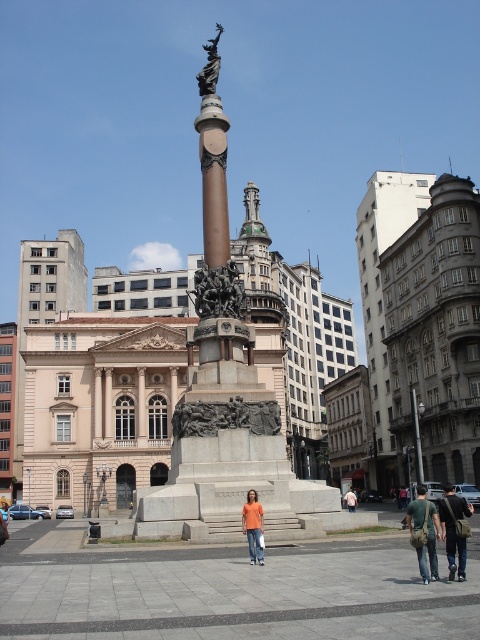
You are a photographer standing in the urban square and see the orange shirt at center and the orange cotton shirt at center. Which one do you need to adjust your camera angle upwards to capture properly?

The orange shirt at center is much taller than the orange cotton shirt at center, so you need to adjust your camera angle upwards to capture the orange shirt at center properly.